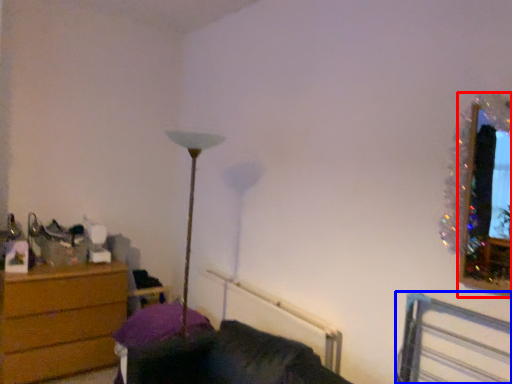
Question: Which object appears closest to the camera in this image, picture frame (highlighted by a red box) or bed frame (highlighted by a blue box)?

Choices:
 (A) picture frame
 (B) bed frame

Answer: (B)